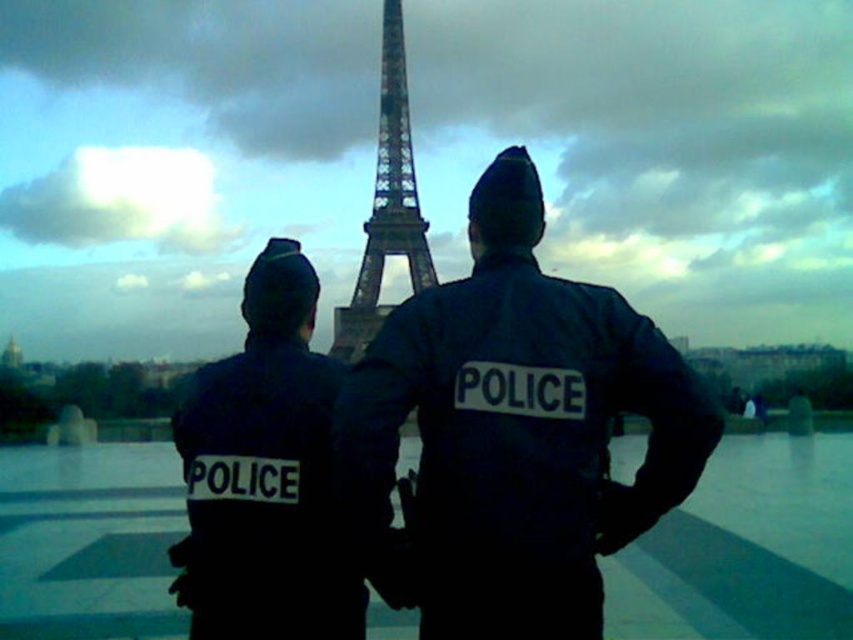
What do you see at coordinates (515, 429) in the screenshot? Image resolution: width=853 pixels, height=640 pixels. I see `dark blue uniform at center` at bounding box center [515, 429].

Which is behind, point (363, 387) or point (279, 253)?

Point (279, 253)

At what (x,y) coordinates should I click in order to perform the action: click on dark blue uniform at center. Please return your answer as a coordinate pair (x, y). This screenshot has width=853, height=640. Looking at the image, I should click on click(x=515, y=429).

Is dark blue uniform at center taller than metallic lattice structure at center?

Indeed, dark blue uniform at center has a greater height compared to metallic lattice structure at center.

The width and height of the screenshot is (853, 640). I want to click on dark blue uniform at center, so click(x=515, y=429).

Which is behind, point (589, 593) or point (403, 196)?

Point (589, 593)

This screenshot has width=853, height=640. I want to click on dark blue uniform at center, so click(x=515, y=429).

Who is lower down, black matte uniform at center or metallic lattice structure at center?

black matte uniform at center is lower down.

Does point (296, 420) come closer to viewer compared to point (419, 257)?

No, it is not.

The image size is (853, 640). I want to click on black matte uniform at center, so coord(265,474).